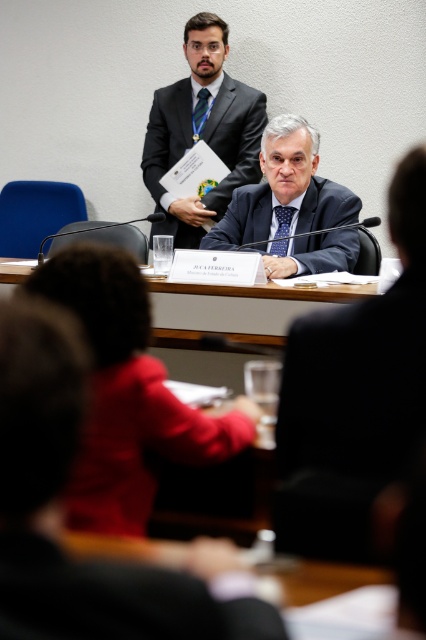
Where is `dark blue fabric business suit at center`? This screenshot has height=640, width=426. dark blue fabric business suit at center is located at coordinates (348, 419).

The width and height of the screenshot is (426, 640). Find the location of `dark blue fabric business suit at center`. dark blue fabric business suit at center is located at coordinates (348, 419).

Is point (370, 552) positioned in front of point (275, 620)?

No, (370, 552) is further to viewer.

Is dark blue fabric business suit at center further to camera compared to black fabric business suit at center?

Yes, dark blue fabric business suit at center is further from the viewer.

Find the location of `dark blue fabric business suit at center`. dark blue fabric business suit at center is located at coordinates (348, 419).

Who is taller, dark blue fabric business suit at center or matte black jacket at center?

matte black jacket at center is taller.

Can you confirm if dark blue fabric business suit at center is positioned above matte black jacket at center?

Actually, dark blue fabric business suit at center is below matte black jacket at center.

You are a GUI agent. You are given a task and a screenshot of the screen. Output one action in this format:
    pyautogui.click(x=<x>, y=<y>)
    Task: Click on the dark blue fabric business suit at center
    The image size is (426, 640).
    Given the screenshot: What is the action you would take?
    pyautogui.click(x=348, y=419)